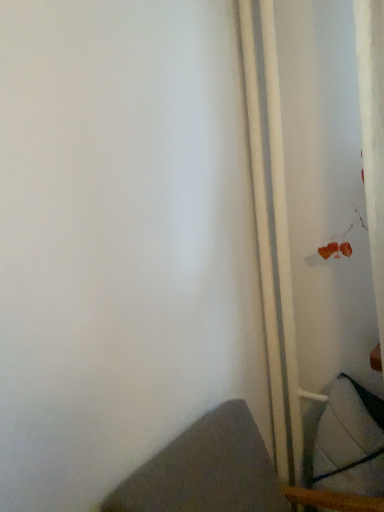
Consider the image. Measure the distance between textured gray cushion at lower right and camera.

textured gray cushion at lower right and camera are 33.25 inches apart.

What is the approximate width of textured gray cushion at lower right?

20.95 inches.

The width and height of the screenshot is (384, 512). I want to click on textured gray cushion at lower right, so click(x=206, y=470).

What do you see at coordinates (206, 470) in the screenshot? I see `textured gray cushion at lower right` at bounding box center [206, 470].

Locate an element on the screen. This screenshot has width=384, height=512. textured gray cushion at lower right is located at coordinates (206, 470).